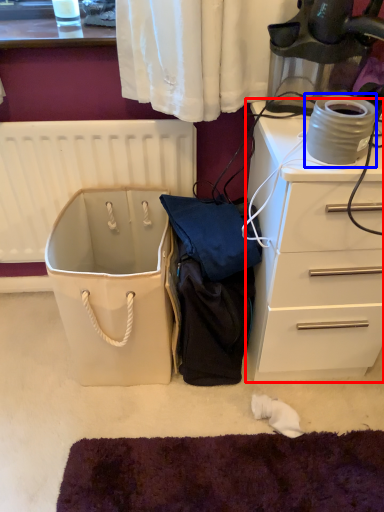
Question: Which object appears closest to the camera in this image, chest of drawers (highlighted by a red box) or appliance (highlighted by a blue box)?

Choices:
 (A) chest of drawers
 (B) appliance

Answer: (B)